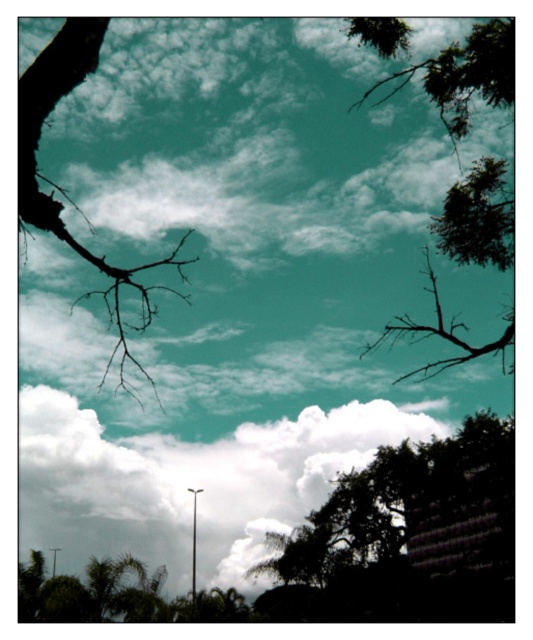
Between white fluffy cloud at center and brown/dry wood tree branch at upper right, which one appears on the right side from the viewer's perspective?

brown/dry wood tree branch at upper right

Is white fluffy cloud at center thinner than brown/dry wood tree branch at upper right?

In fact, white fluffy cloud at center might be wider than brown/dry wood tree branch at upper right.

Which is in front, point (43, 392) or point (469, 346)?

Point (469, 346) is more forward.

Where is `white fluffy cloud at center`? The width and height of the screenshot is (533, 640). white fluffy cloud at center is located at coordinates (188, 483).

Which of these two, green leafy tree at center or brown/dry wood tree branch at upper right, stands taller?

Standing taller between the two is green leafy tree at center.

Does point (268, 600) lie behind point (364, 348)?

Yes, point (268, 600) is farther from viewer.

Which is behind, point (348, 545) or point (488, 353)?

The point (348, 545) is more distant.

I want to click on green leafy tree at center, so click(x=409, y=536).

Identify the location of green leafy tree at center. (409, 536).

Between green leafy tree at center and black matte branch at left, which one has more height?

green leafy tree at center is taller.

Where is `green leafy tree at center`? green leafy tree at center is located at coordinates (409, 536).